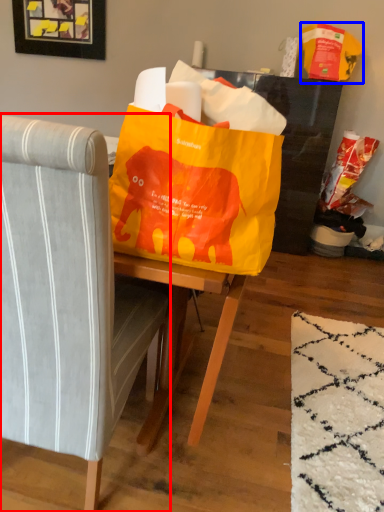
Question: Which object appears closest to the camera in this image, chair (highlighted by a red box) or grocery bag (highlighted by a blue box)?

Choices:
 (A) chair
 (B) grocery bag

Answer: (A)